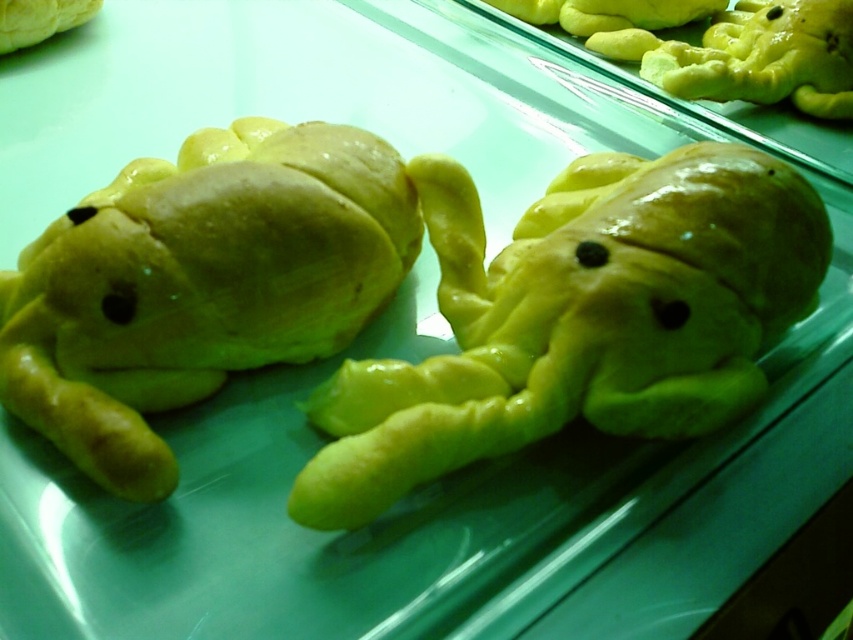
Between point (793, 282) and point (218, 340), which one is positioned behind?

Positioned behind is point (793, 282).

Looking at this image, who is positioned more to the right, yellow matte dough at center or yellow matte frog at left?

From the viewer's perspective, yellow matte dough at center appears more on the right side.

Is point (621, 417) behind point (173, 196)?

No, (621, 417) is in front of (173, 196).

Where is `yellow matte dough at center`? This screenshot has height=640, width=853. yellow matte dough at center is located at coordinates (577, 321).